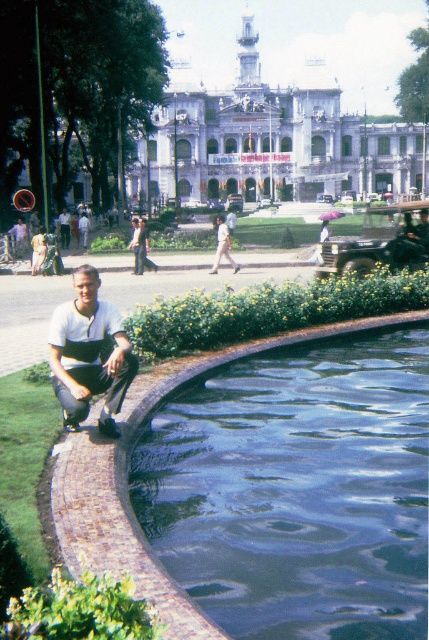
You are standing at the edge of the blue polished stone pool at lower center and want to take a photo of the white stone building at center. Since the pool is between you and the building, will the building be visible in your photo?

The blue polished stone pool at lower center is below the white stone building at center. Since the pool is positioned lower than the building, the building should still be visible above the pool in your photo.